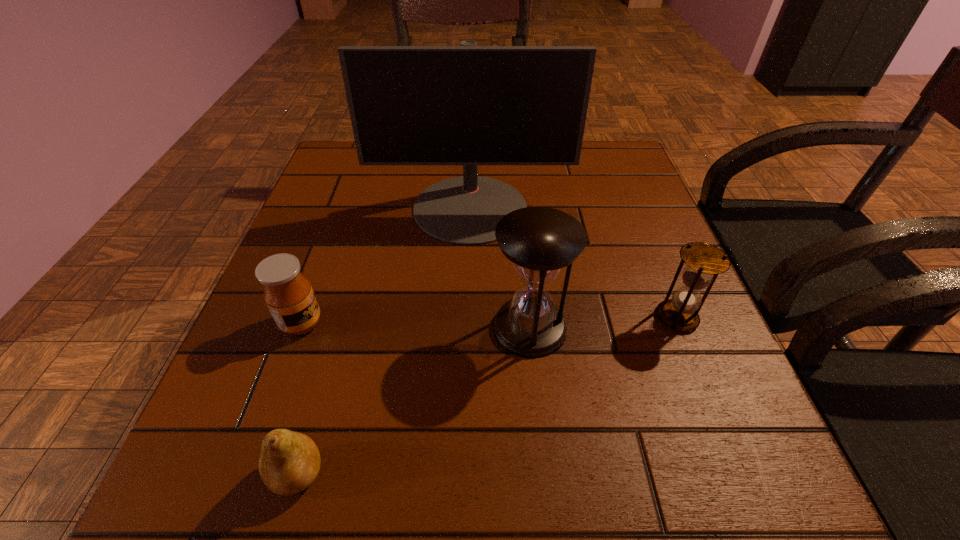
The width and height of the screenshot is (960, 540). I want to click on free space in the image that satisfies the following two spatial constraints: 1. on the screen of the tallest object; 2. on the front-facing side of the honey, so click(x=468, y=323).

I want to click on vacant space that satisfies the following two spatial constraints: 1. on the back side of the rightmost object; 2. on the left side of the nearest object, so click(x=342, y=318).